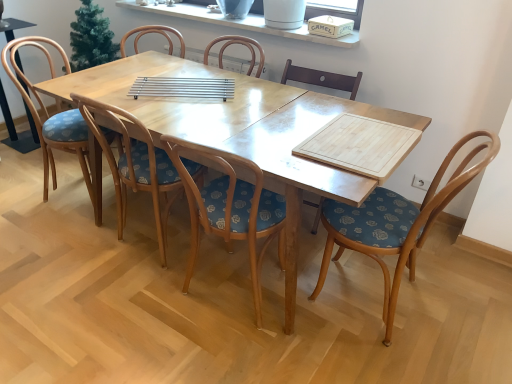
The image size is (512, 384). Identify the location of vacant area that lies between woodenwoodenchair at right, the 1th chair in the right-to-left sequence, and light wood table at center. (377, 339).